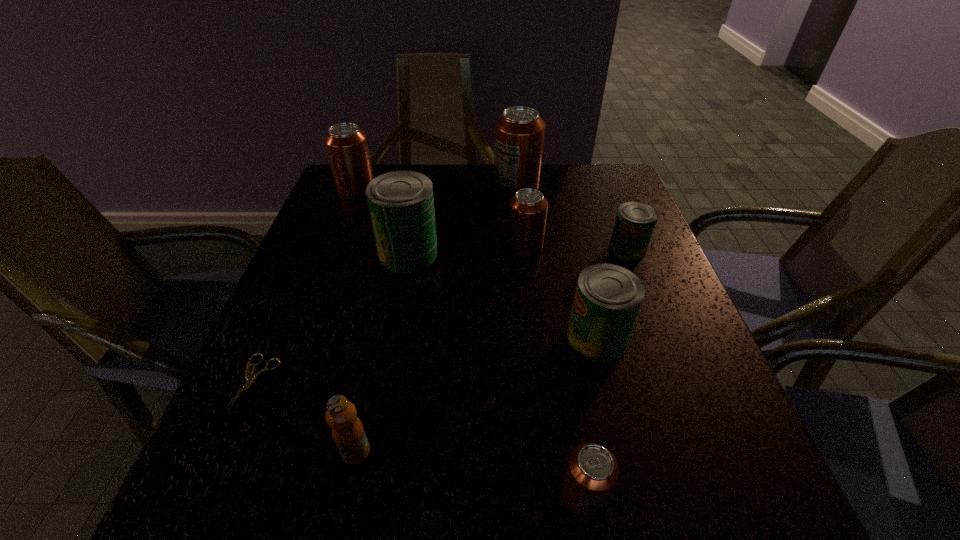
Locate an element on the screen. the biggest orange can is located at coordinates (519, 132).

You are a GUI agent. You are given a task and a screenshot of the screen. Output one action in this format:
    pyautogui.click(x=<x>, y=<y>)
    Task: Click on the tallest object
    The image size is (960, 540).
    Given the screenshot: What is the action you would take?
    pyautogui.click(x=519, y=132)

Identify the location of the leftmost orange can. (346, 144).

Identify the location of the leftmost can. (346, 144).

Image resolution: width=960 pixels, height=540 pixels. I want to click on the leftmost green can, so click(401, 203).

The height and width of the screenshot is (540, 960). In order to click on the sixth can from right to left in this screenshot , I will do `click(401, 203)`.

This screenshot has width=960, height=540. Find the location of `the second smallest orange can`. the second smallest orange can is located at coordinates (528, 207).

Find the location of `the second green can from left to right`. the second green can from left to right is located at coordinates (608, 297).

This screenshot has width=960, height=540. Identify the location of the second smallest green can. (608, 297).

You are a GUI agent. You are given a task and a screenshot of the screen. Output one action in this format:
    pyautogui.click(x=<x>, y=<y>)
    Task: Click on the orange juice
    The width and height of the screenshot is (960, 540).
    Given the screenshot: What is the action you would take?
    pyautogui.click(x=348, y=433)